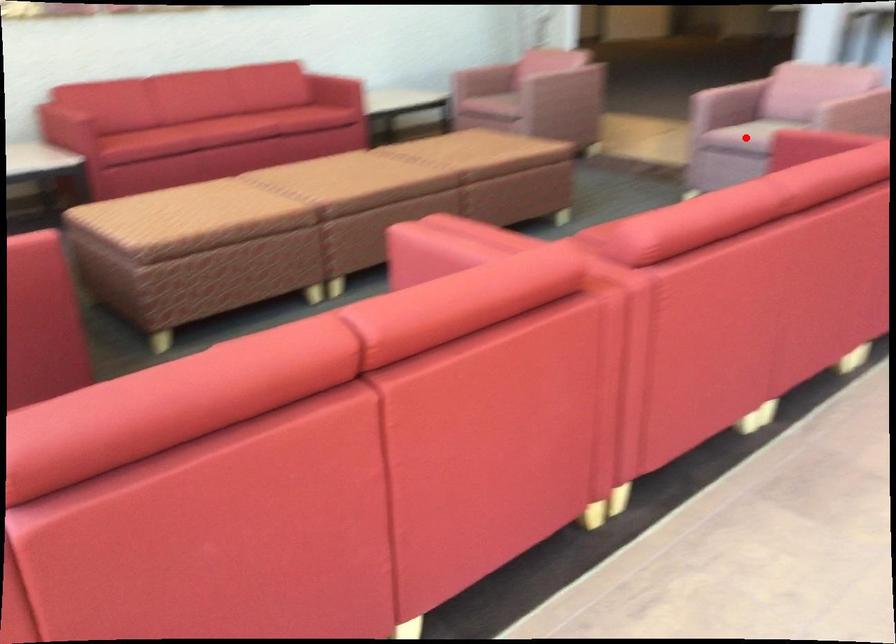
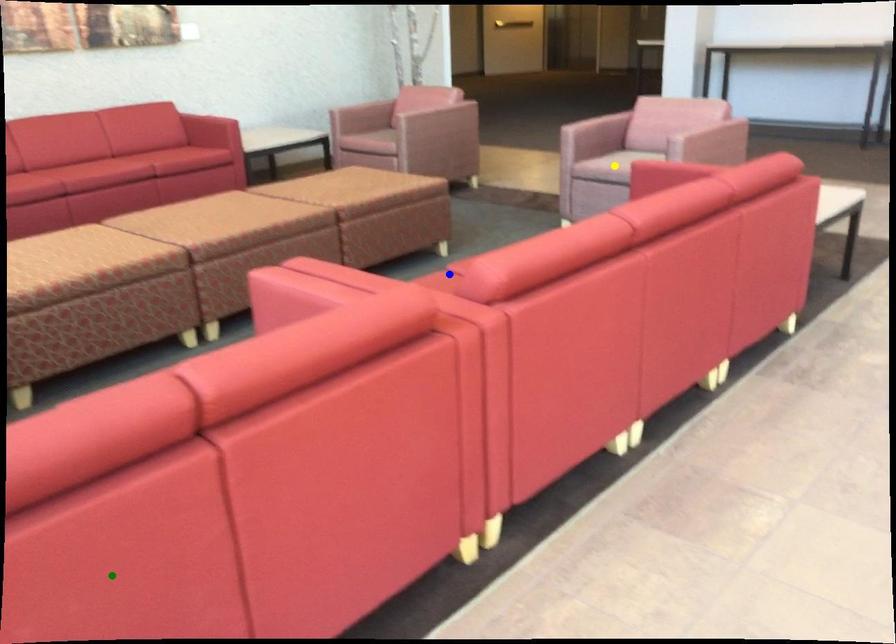
Question: I am providing you with two images of the same scene from different viewpoints. A red point is marked on the first image. You are given multiple points on the second image. In image 2, which mark is for the same physical point as the one in image 1?

Choices:
 (A) yellow point
 (B) blue point
 (C) green point

Answer: (A)